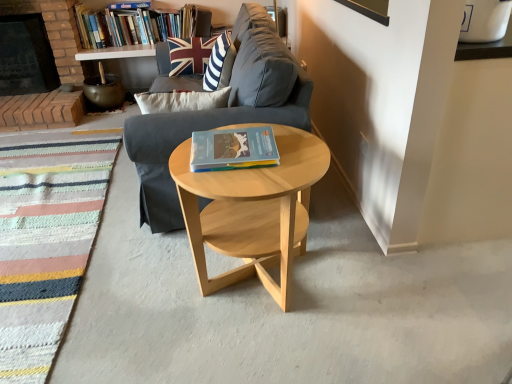
The image size is (512, 384). Find the location of `brick fireplace at left`. brick fireplace at left is located at coordinates (26, 56).

Where is `hardcover book at upper center, marked as the 1th book in a back-to-front arrangement`? The width and height of the screenshot is (512, 384). hardcover book at upper center, marked as the 1th book in a back-to-front arrangement is located at coordinates (139, 25).

This screenshot has width=512, height=384. Describe the element at coordinates (252, 210) in the screenshot. I see `natural wood side table at center` at that location.

The image size is (512, 384). I want to click on natural wood side table at center, so click(x=252, y=210).

Locate an element on the screen. The width and height of the screenshot is (512, 384). union jack fabric pillow at upper center is located at coordinates (193, 53).

The height and width of the screenshot is (384, 512). What do you see at coordinates (193, 53) in the screenshot?
I see `union jack fabric pillow at upper center` at bounding box center [193, 53].

What do you see at coordinates (233, 149) in the screenshot?
I see `hardcover book at center, which is counted as the 2th book, starting from the back` at bounding box center [233, 149].

This screenshot has width=512, height=384. What are the coordinates of `striped fabric rug at lower left` in the screenshot? It's located at (45, 243).

From the image's perspective, between union jack fabric pillow at upper center and striped fabric rug at lower left, which one is located above?

union jack fabric pillow at upper center is shown above in the image.

Is point (200, 49) closer to camera compared to point (54, 286)?

That is False.

Measure the distance from union jack fabric pillow at upper center to striped fabric rug at lower left.

1.21 meters.

From the picture: In the image, is union jack fabric pillow at upper center positioned in front of or behind striped fabric rug at lower left?

union jack fabric pillow at upper center is positioned farther from the viewer than striped fabric rug at lower left.

Is hardcover book at center, which is counted as the 2th book, starting from the back, positioned far away from hardcover book at upper center, which is the 2th book in right-to-left order?

Yes.

Considering the sizes of objects hardcover book at center, the 1th book viewed from the right, and hardcover book at upper center, placed as the 2th book when sorted from bottom to top, in the image provided, who is taller, hardcover book at center, the 1th book viewed from the right, or hardcover book at upper center, placed as the 2th book when sorted from bottom to top,?

hardcover book at upper center, placed as the 2th book when sorted from bottom to top, is taller.

Can you confirm if hardcover book at center, the 1th book viewed from the right, is wider than hardcover book at upper center, the first book positioned from the left?

Yes.

Is point (121, 14) positioned in front of point (175, 229)?

That is False.

Which of these two, hardcover book at upper center, the second book in the front-to-back sequence, or gray fabric couch at center, is wider?

gray fabric couch at center is wider.

Can you confirm if hardcover book at upper center, which is the 1th book from top to bottom, is smaller than gray fabric couch at center?

Indeed, hardcover book at upper center, which is the 1th book from top to bottom, has a smaller size compared to gray fabric couch at center.

Which point is more forward, [286,281] or [256,69]?

The point [286,281] is in front.

Looking at their sizes, would you say natural wood side table at center is wider or thinner than gray fabric couch at center?

natural wood side table at center is thinner than gray fabric couch at center.

How different are the orientations of natural wood side table at center and gray fabric couch at center in degrees?

There is a 7.58e-05-degree angle between the facing directions of natural wood side table at center and gray fabric couch at center.

Is striped fabric rug at lower left in front of or behind hardcover book at upper center, the second book in the front-to-back sequence, in the image?

Visually, striped fabric rug at lower left is located in front of hardcover book at upper center, the second book in the front-to-back sequence.

Does point (85, 242) come closer to viewer compared to point (91, 45)?

Yes, point (85, 242) is closer to viewer.

What's the angular difference between striped fabric rug at lower left and hardcover book at upper center, which is the 2th book in right-to-left order,'s facing directions?

1.26 degrees separate the facing orientations of striped fabric rug at lower left and hardcover book at upper center, which is the 2th book in right-to-left order.

Consider the image. Who is smaller, striped fabric rug at lower left or hardcover book at upper center, which is the 1th book from top to bottom?

striped fabric rug at lower left.

From the image's perspective, which is below, natural wood side table at center or hardcover book at center, the second book from the left?

natural wood side table at center.

Is natural wood side table at center positioned in front of hardcover book at center, which is counted as the second book, starting from the top?

Yes, natural wood side table at center is closer to the camera.

Considering the sizes of objects natural wood side table at center and hardcover book at center, which is counted as the 2th book, starting from the back, in the image provided, who is wider, natural wood side table at center or hardcover book at center, which is counted as the 2th book, starting from the back,?

natural wood side table at center.

Where is `coffee table below the hardcover book at center, the second book from the left (from the image's perspective)`? coffee table below the hardcover book at center, the second book from the left (from the image's perspective) is located at coordinates (252, 210).

Is gray fabric couch at center not within hardcover book at center, which is counted as the first book, starting from the front?

Absolutely, gray fabric couch at center is external to hardcover book at center, which is counted as the first book, starting from the front.

Is gray fabric couch at center turned away from hardcover book at center, the second book from the left?

gray fabric couch at center is not turned away from hardcover book at center, the second book from the left.

In order to click on studio couch on the left of the hardcover book at center, which is counted as the first book, starting from the front in this screenshot , I will do `click(220, 113)`.

From a real-world perspective, is gray fabric couch at center physically located above or below hardcover book at center, which is counted as the first book, starting from the front?

gray fabric couch at center is situated lower than hardcover book at center, which is counted as the first book, starting from the front, in the real world.

Image resolution: width=512 pixels, height=384 pixels. Identify the location of pillow located above the striped fabric rug at lower left (from the image's perspective). (193, 53).

The width and height of the screenshot is (512, 384). What are the coordinates of `book on the left of hardcover book at center, which is counted as the first book, starting from the front` in the screenshot? It's located at (139, 25).

Considering their positions, is hardcover book at center, which is counted as the first book, starting from the front, positioned closer to union jack fabric pillow at upper center than gray fabric couch at center?

gray fabric couch at center is positioned closer to the anchor union jack fabric pillow at upper center.

Which object lies nearer to the anchor point hardcover book at center, which is counted as the 2th book, starting from the back, hardcover book at upper center, which is the 1th book from top to bottom, or gray fabric couch at center?

Among the two, gray fabric couch at center is located nearer to hardcover book at center, which is counted as the 2th book, starting from the back.

Based on their spatial positions, is gray fabric couch at center or brick fireplace at left closer to hardcover book at upper center, marked as the 1th book in a back-to-front arrangement?

Among the two, brick fireplace at left is located nearer to hardcover book at upper center, marked as the 1th book in a back-to-front arrangement.

Considering their positions, is hardcover book at center, the second book from the left, positioned further to union jack fabric pillow at upper center than natural wood side table at center?

Based on the image, natural wood side table at center appears to be further to union jack fabric pillow at upper center.

Considering their positions, is striped fabric rug at lower left positioned further to brick fireplace at left than hardcover book at upper center, marked as the 1th book in a back-to-front arrangement?

striped fabric rug at lower left lies further to brick fireplace at left than the other object.

Which object lies nearer to the anchor point striped fabric rug at lower left, gray fabric couch at center or natural wood side table at center?

Among the two, gray fabric couch at center is located nearer to striped fabric rug at lower left.

When comparing their distances from natural wood side table at center, does gray fabric couch at center or striped fabric rug at lower left seem further?

striped fabric rug at lower left is positioned further to the anchor natural wood side table at center.

Which object lies further to the anchor point gray fabric couch at center, natural wood side table at center or brick fireplace at left?

brick fireplace at left is positioned further to the anchor gray fabric couch at center.

At what (x,y) coordinates should I click in order to perform the action: click on fireplace between natural wood side table at center and hardcover book at upper center, placed as the 2th book when sorted from bottom to top, along the z-axis. Please return your answer as a coordinate pair (x, y). This screenshot has height=384, width=512. Looking at the image, I should click on (26, 56).

At what (x,y) coordinates should I click in order to perform the action: click on pillow situated between brick fireplace at left and gray fabric couch at center from left to right. Please return your answer as a coordinate pair (x, y). Looking at the image, I should click on (193, 53).

This screenshot has width=512, height=384. Identify the location of studio couch located between striped fabric rug at lower left and hardcover book at upper center, placed as the 2th book when sorted from bottom to top, in the depth direction. (220, 113).

This screenshot has width=512, height=384. Find the location of `pillow between brick fireplace at left and natural wood side table at center in the horizontal direction`. pillow between brick fireplace at left and natural wood side table at center in the horizontal direction is located at coordinates (193, 53).